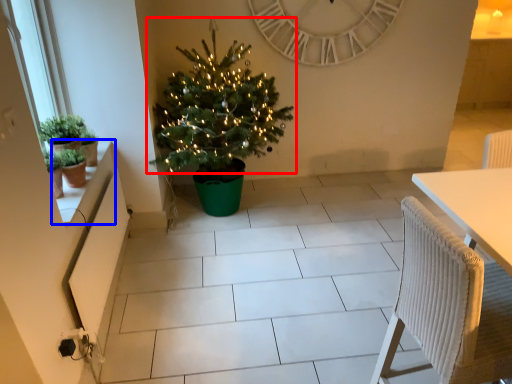
Question: Which point is further to the camera, christmas tree (highlighted by a red box) or window sill (highlighted by a blue box)?

Choices:
 (A) christmas tree
 (B) window sill

Answer: (A)